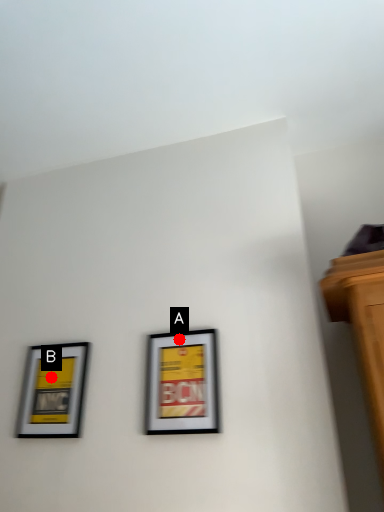
Question: Two points are circled on the image, labeled by A and B beside each circle. Which point is closer to the camera taking this photo?

Choices:
 (A) A is closer
 (B) B is closer

Answer: (A)